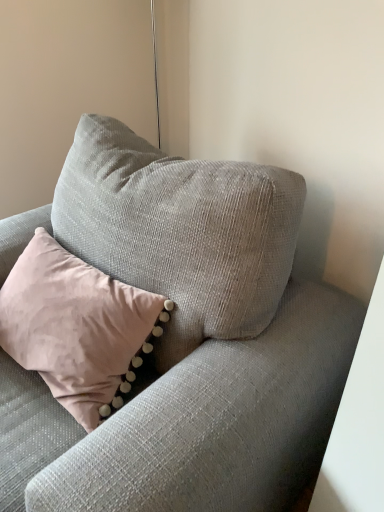
Describe the element at coordinates (183, 339) in the screenshot. I see `textured gray couch at center` at that location.

This screenshot has height=512, width=384. Find the location of `textured gray couch at center`. textured gray couch at center is located at coordinates (183, 339).

Locate an element on the screen. The width and height of the screenshot is (384, 512). pink velvet pillow at upper left is located at coordinates (73, 325).

What do you see at coordinates (73, 325) in the screenshot?
I see `pink velvet pillow at upper left` at bounding box center [73, 325].

What is the approximate height of pink velvet pillow at upper left?

It is 20.75 inches.

Find the location of a particular element. textured gray couch at center is located at coordinates (183, 339).

Which is more to the left, textured gray couch at center or pink velvet pillow at upper left?

Positioned to the left is pink velvet pillow at upper left.

Between textured gray couch at center and pink velvet pillow at upper left, which one is positioned in front?

textured gray couch at center is closer to the camera.

Considering the positions of point (108, 492) and point (18, 340), is point (108, 492) closer or farther from the camera than point (18, 340)?

Point (108, 492) is closer to the camera than point (18, 340).

From the picture: From the image's perspective, is textured gray couch at center beneath pink velvet pillow at upper left?

Yes, from the image's perspective, textured gray couch at center is below pink velvet pillow at upper left.

From a real-world perspective, does textured gray couch at center sit lower than pink velvet pillow at upper left?

Yes, from a real-world perspective, textured gray couch at center is below pink velvet pillow at upper left.

Which object is thinner, textured gray couch at center or pink velvet pillow at upper left?

With smaller width is pink velvet pillow at upper left.

Considering the sizes of objects textured gray couch at center and pink velvet pillow at upper left in the image provided, who is shorter, textured gray couch at center or pink velvet pillow at upper left?

pink velvet pillow at upper left.

Considering the sizes of textured gray couch at center and pink velvet pillow at upper left in the image, is textured gray couch at center bigger or smaller than pink velvet pillow at upper left?

textured gray couch at center is bigger than pink velvet pillow at upper left.

Is pink velvet pillow at upper left completely or partially inside textured gray couch at center?

Yes, pink velvet pillow at upper left is surrounded by textured gray couch at center.

Consider the image. Is textured gray couch at center in contact with pink velvet pillow at upper left?

No.

Is textured gray couch at center positioned with its back to pink velvet pillow at upper left?

Yes.

Image resolution: width=384 pixels, height=512 pixels. What are the coordinates of `studio couch located in front of the pink velvet pillow at upper left` in the screenshot? It's located at (183, 339).

Can you confirm if pink velvet pillow at upper left is positioned to the right of textured gray couch at center?

No.

Is pink velvet pillow at upper left in front of or behind textured gray couch at center in the image?

pink velvet pillow at upper left is positioned farther from the viewer than textured gray couch at center.

Is point (99, 396) less distant than point (312, 399)?

No, (99, 396) is behind (312, 399).

From the image's perspective, does pink velvet pillow at upper left appear higher than textured gray couch at center?

Yes, from the image's perspective, pink velvet pillow at upper left is over textured gray couch at center.

From a real-world perspective, is pink velvet pillow at upper left positioned under textured gray couch at center based on gravity?

No, from a real-world perspective, pink velvet pillow at upper left is not under textured gray couch at center.

Is pink velvet pillow at upper left wider than textured gray couch at center?

No.

Does pink velvet pillow at upper left have a lesser height compared to textured gray couch at center?

Indeed, pink velvet pillow at upper left has a lesser height compared to textured gray couch at center.

Between pink velvet pillow at upper left and textured gray couch at center, which one has larger size?

With larger size is textured gray couch at center.

Can textured gray couch at center be found inside pink velvet pillow at upper left?

No, textured gray couch at center is not surrounded by pink velvet pillow at upper left.

Does pink velvet pillow at upper left touch textured gray couch at center?

No, pink velvet pillow at upper left is not making contact with textured gray couch at center.

Is pink velvet pillow at upper left oriented away from textured gray couch at center?

Absolutely, pink velvet pillow at upper left is directed away from textured gray couch at center.

How many degrees apart are the facing directions of pink velvet pillow at upper left and textured gray couch at center?

There is a 1.28-degree angle between the facing directions of pink velvet pillow at upper left and textured gray couch at center.

Find the location of a particular element. pillow above the textured gray couch at center (from a real-world perspective) is located at coordinates (73, 325).

Where is `pillow on the left of textured gray couch at center`? pillow on the left of textured gray couch at center is located at coordinates (73, 325).

Locate an element on the screen. The image size is (384, 512). pillow above the textured gray couch at center (from the image's perspective) is located at coordinates (73, 325).